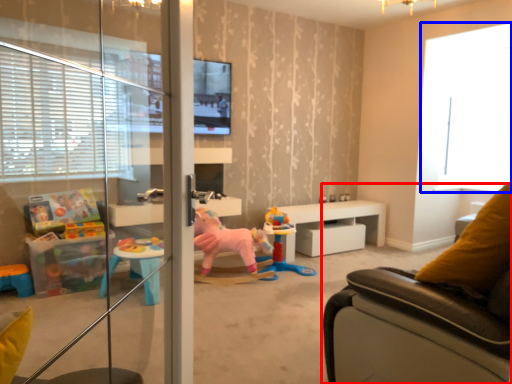
Question: Which point is closer to the camera, studio couch (highlighted by a red box) or window (highlighted by a blue box)?

Choices:
 (A) studio couch
 (B) window

Answer: (A)